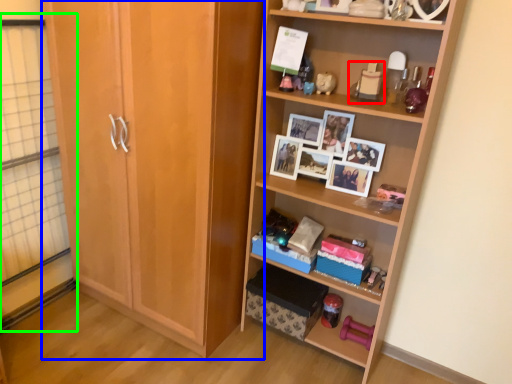
Question: Estimate the real-world distances between objects in this image. Which object is farther from toy (highlighted by a red box), cabinetry (highlighted by a blue box) or glass door (highlighted by a green box)?

Choices:
 (A) cabinetry
 (B) glass door

Answer: (B)